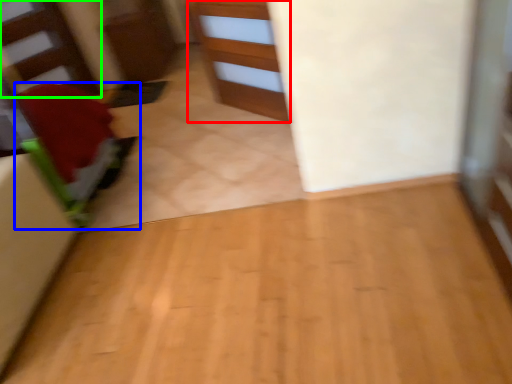
Question: Which object is the farthest from cabinetry (highlighted by a red box)? Choose among these: furniture (highlighted by a blue box) or stairwell (highlighted by a green box).

Choices:
 (A) furniture
 (B) stairwell

Answer: (B)